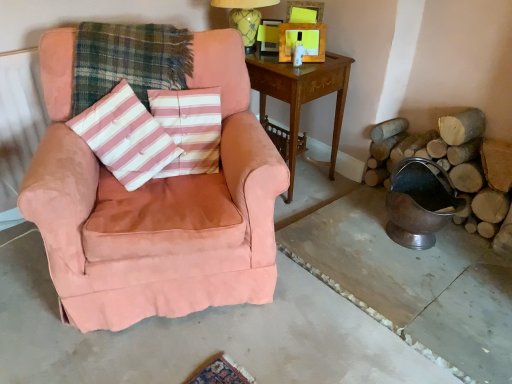
Question: Is pink suede armchair at left not within suede pink armchair at left?

Choices:
 (A) no
 (B) yes

Answer: (B)

Question: Is pink suede armchair at left directly adjacent to suede pink armchair at left?

Choices:
 (A) no
 (B) yes

Answer: (A)

Question: Is pink suede armchair at left shorter than suede pink armchair at left?

Choices:
 (A) yes
 (B) no

Answer: (A)

Question: Is pink suede armchair at left positioned behind suede pink armchair at left?

Choices:
 (A) yes
 (B) no

Answer: (B)

Question: Is pink suede armchair at left facing away from suede pink armchair at left?

Choices:
 (A) yes
 (B) no

Answer: (B)

Question: From a real-world perspective, is pink suede armchair at left over suede pink armchair at left?

Choices:
 (A) no
 (B) yes

Answer: (A)

Question: Is plaid fabric at center completely or partially outside of natural wood logs at right?

Choices:
 (A) no
 (B) yes

Answer: (B)

Question: Is plaid fabric at center at the left side of natural wood logs at right?

Choices:
 (A) no
 (B) yes

Answer: (B)

Question: Considering the relative sizes of plaid fabric at center and natural wood logs at right in the image provided, is plaid fabric at center thinner than natural wood logs at right?

Choices:
 (A) no
 (B) yes

Answer: (A)

Question: From a real-world perspective, is plaid fabric at center over natural wood logs at right?

Choices:
 (A) yes
 (B) no

Answer: (A)

Question: Can you confirm if plaid fabric at center is smaller than natural wood logs at right?

Choices:
 (A) yes
 (B) no

Answer: (B)

Question: Is plaid fabric at center not close to natural wood logs at right?

Choices:
 (A) no
 (B) yes

Answer: (B)

Question: From the image's perspective, is wooden side table at center above pink striped fabric pillow at center?

Choices:
 (A) yes
 (B) no

Answer: (A)